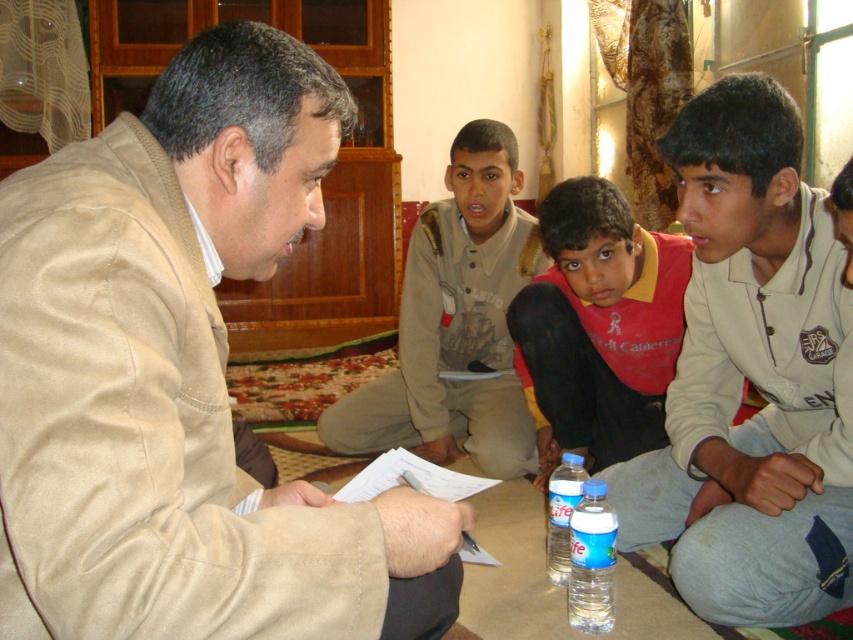
You are a delivery person who needs to place a 12 inch long package between the beige suede jacket at left and the clear plastic water bottle at lower center. Can the package fit in the space between them?

The beige suede jacket at left and clear plastic water bottle at lower center are 38.86 inches apart. Since the package is 12 inches long, there is sufficient space to place it between them.

You are a guest at this event and want to get a drink of water. Where should you look for the clear plastic bottle at lower center?

The clear plastic bottle at lower center is located at point (592, 561).